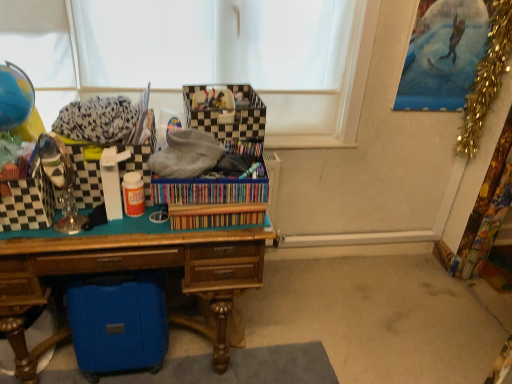
In order to click on spots to the right of wooden desk at center in this screenshot , I will do `click(317, 308)`.